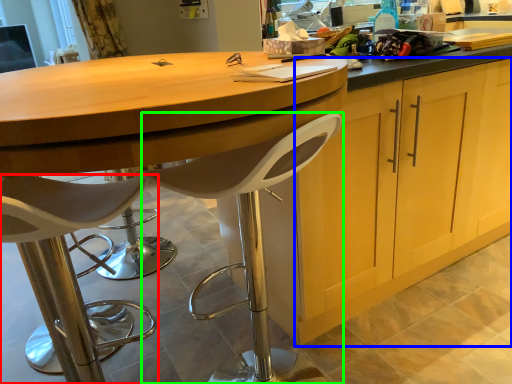
Question: Which is farther away from chair (highlighted by a red box)? cabinetry (highlighted by a blue box) or chair (highlighted by a green box)?

Choices:
 (A) cabinetry
 (B) chair

Answer: (A)